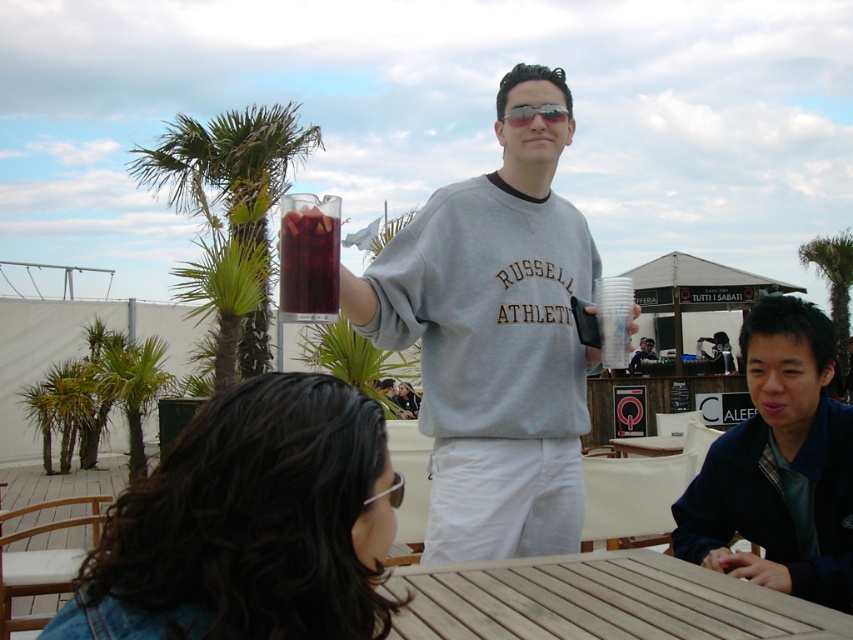
Does green leafy palm tree at upper center appear under sunglasses at center?

Indeed, green leafy palm tree at upper center is positioned under sunglasses at center.

Who is more forward, (810, 250) or (511, 124)?

Point (511, 124) is more forward.

Where is `green leafy palm tree at upper center`? The image size is (853, 640). green leafy palm tree at upper center is located at coordinates (833, 276).

Is dark blue jacket at lower right shorter than matte gray sweatshirt at center?

No.

Is dark blue jacket at lower right below matte gray sweatshirt at center?

Actually, dark blue jacket at lower right is above matte gray sweatshirt at center.

I want to click on dark blue jacket at lower right, so click(779, 465).

This screenshot has height=640, width=853. Find the location of `dark blue jacket at lower right`. dark blue jacket at lower right is located at coordinates (779, 465).

Can you confirm if translucent plastic cup at upper center is positioned to the left of sunglasses at center?

Correct, you'll find translucent plastic cup at upper center to the left of sunglasses at center.

Find the location of a particular element. Image resolution: width=853 pixels, height=640 pixels. translucent plastic cup at upper center is located at coordinates (308, 257).